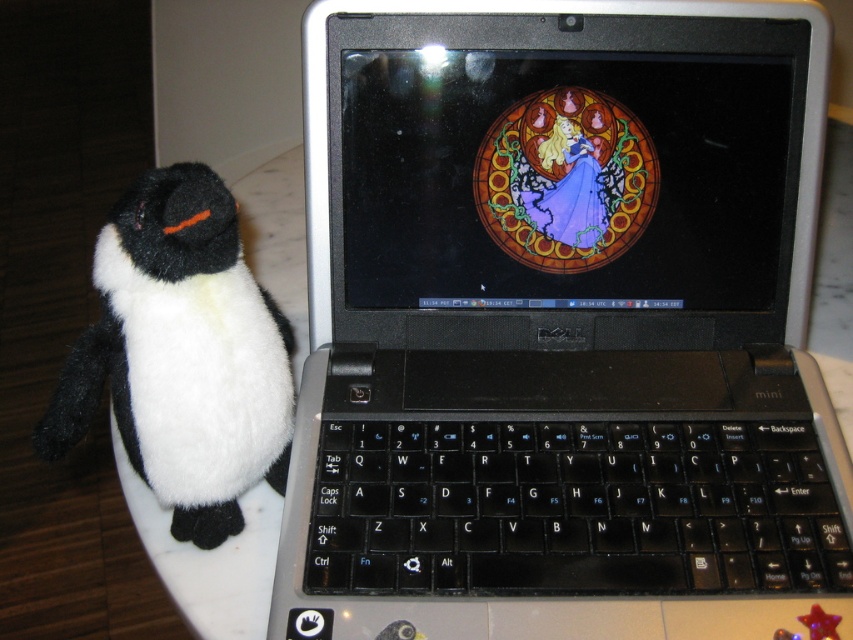
Based on the photo, you are setting up a desk for a child. You have a black plastic laptop at center and a black plastic keyboard at center. Based on their sizes, which one should be placed closer to the edge of the desk to ensure there is enough space for both?

The black plastic keyboard at center should be placed closer to the edge of the desk since it is smaller in size compared to the black plastic laptop at center, allowing more space for the larger laptop.

You are a delivery robot with a package that needs to be placed between the black plastic laptop at center and the black plush penguin at left. The package is 7 inches long. Can the package fit between them without overlapping either object?

The black plastic laptop at center is 7.68 inches away from the black plush penguin at left. Since the package is 7 inches long, it can fit between them without overlapping either object as there is enough space.